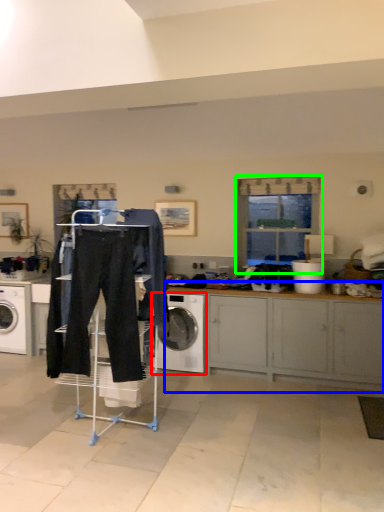
Question: Based on their relative distances, which object is farther from washing machine (highlighted by a red box)? Choose from cabinetry (highlighted by a blue box) and window (highlighted by a green box).

Choices:
 (A) cabinetry
 (B) window

Answer: (B)